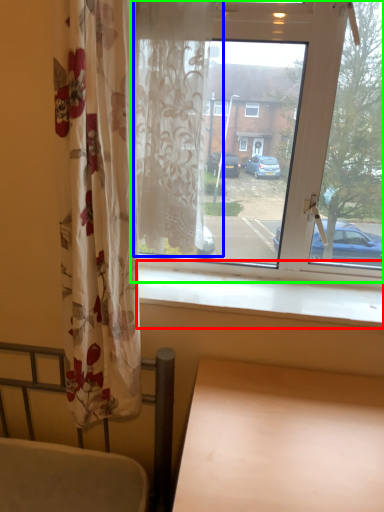
Question: Which object is the closest to the window sill (highlighted by a red box)? Choose among these: curtain (highlighted by a blue box) or window (highlighted by a green box).

Choices:
 (A) curtain
 (B) window

Answer: (B)